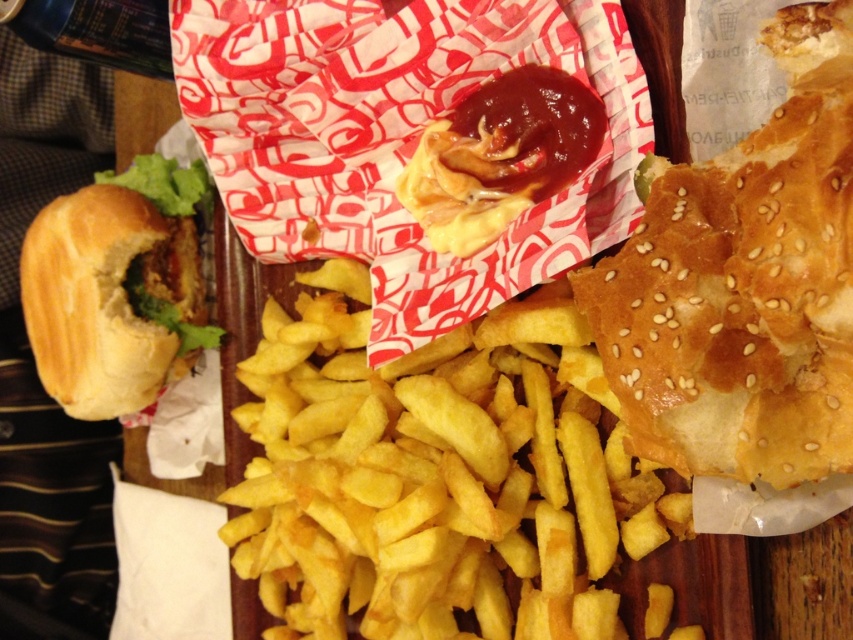
Looking at the burger components in the image, which bun is taller between the sesame seed bun at right and the slightly toasted bun with lettuce at left?

The slightly toasted bun with lettuce at left is taller than the sesame seed bun at right.

You are a food critic standing 6 feet away from the meal. Can you reach the point at coordinates (606, 282) without moving your hand more than 30 inches?

The point at coordinates (606, 282) is 28.92 inches from the viewer, which is within the 30 inch reach distance. Yes, you can reach it without moving your hand more than 30 inches.

You are a food delivery person who needs to pick up the golden crispy french fries at center. The fries are on a wooden surface. If you reach out your hand from where you are standing, will you be able to grab them without moving your feet?

The golden crispy french fries at center and viewer are 32.03 inches apart. Since 32.03 inches is approximately 2.67 feet, which is a typical comfortable reaching distance for most adults, you can grab the golden crispy french fries at center without moving your feet.